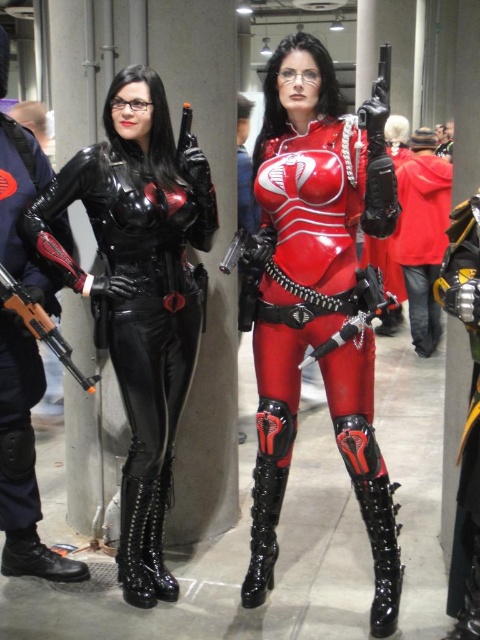
You are a photographer trying to capture a closeup shot of both points in the image. Which point, point (x=384, y=173) or point (x=48, y=332), is closer to your camera lens?

Point (x=384, y=173) is closer to the camera lens than point (x=48, y=332).

What are the coordinates of the red leather jacket at center?

The red leather jacket at center is located at coordinates point (422, 240).